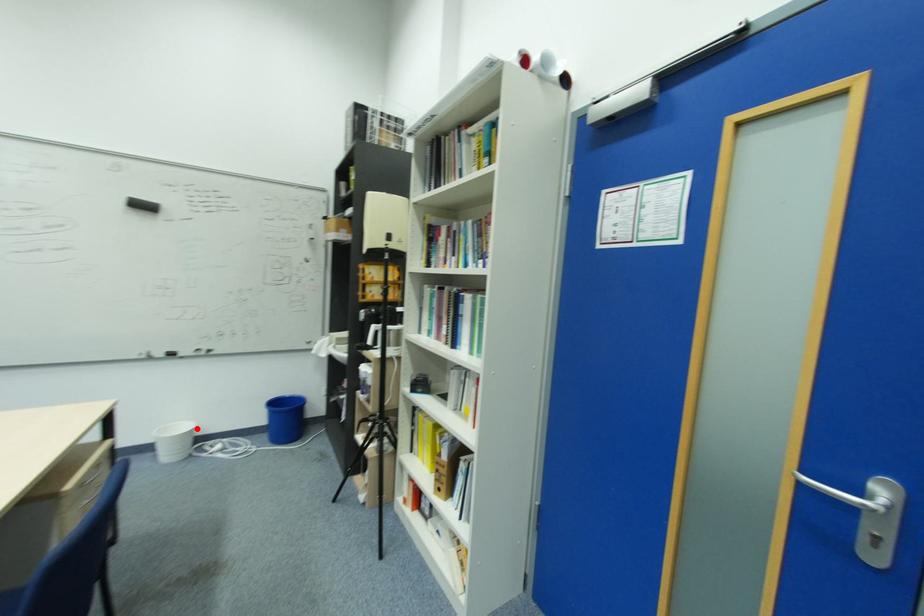
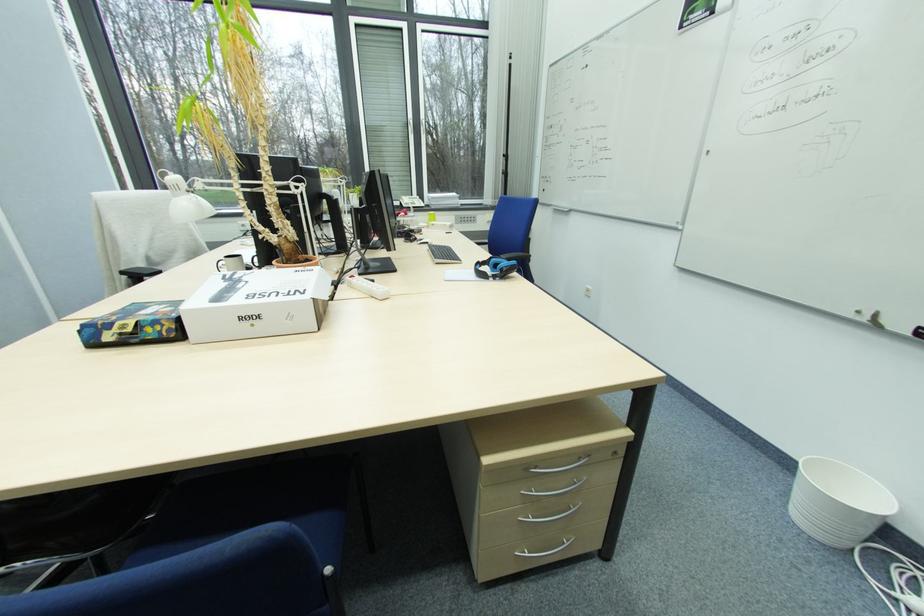
In the second image, find the point that corresponds to the highlighted location in the first image.

(885, 516)